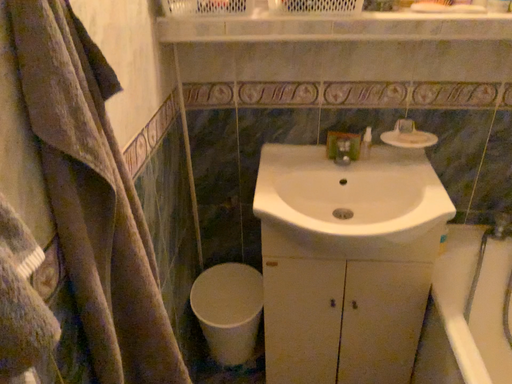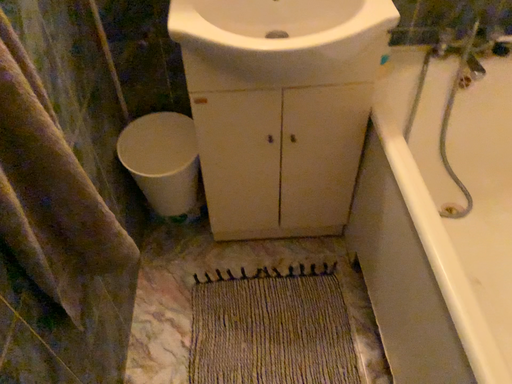
Question: Which way did the camera rotate in the video?

Choices:
 (A) rotated downward
 (B) rotated upward

Answer: (A)